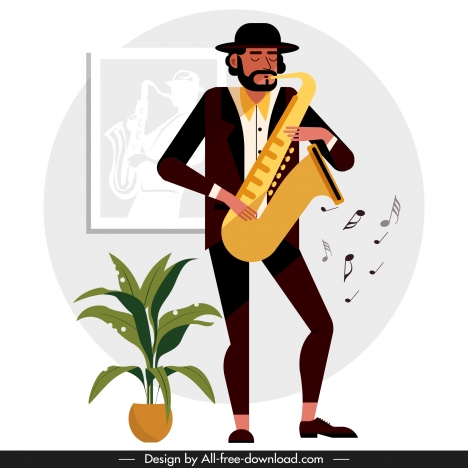
Locate an element on the screen. yellow potted plant container is located at coordinates (147, 420).